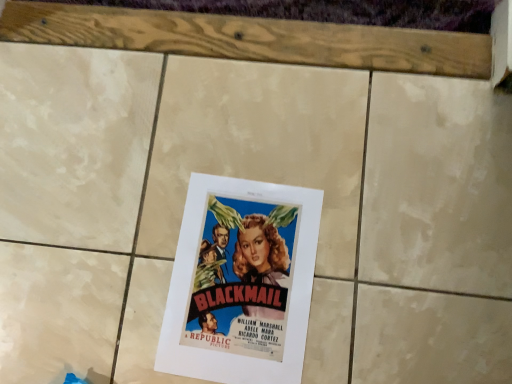
What do you see at coordinates (241, 282) in the screenshot? I see `matte paper poster at center` at bounding box center [241, 282].

Where is `matte paper poster at center`? matte paper poster at center is located at coordinates (241, 282).

I want to click on matte paper poster at center, so click(241, 282).